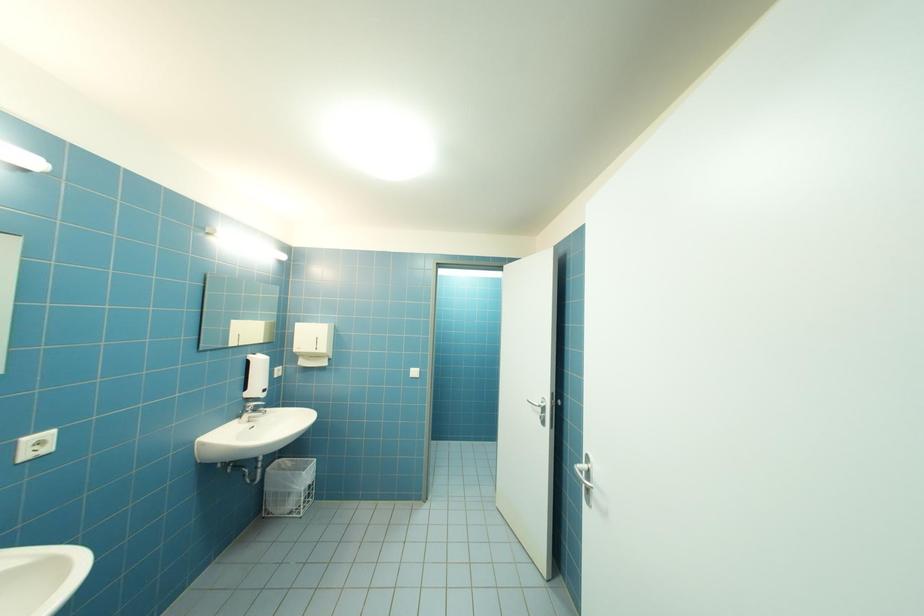
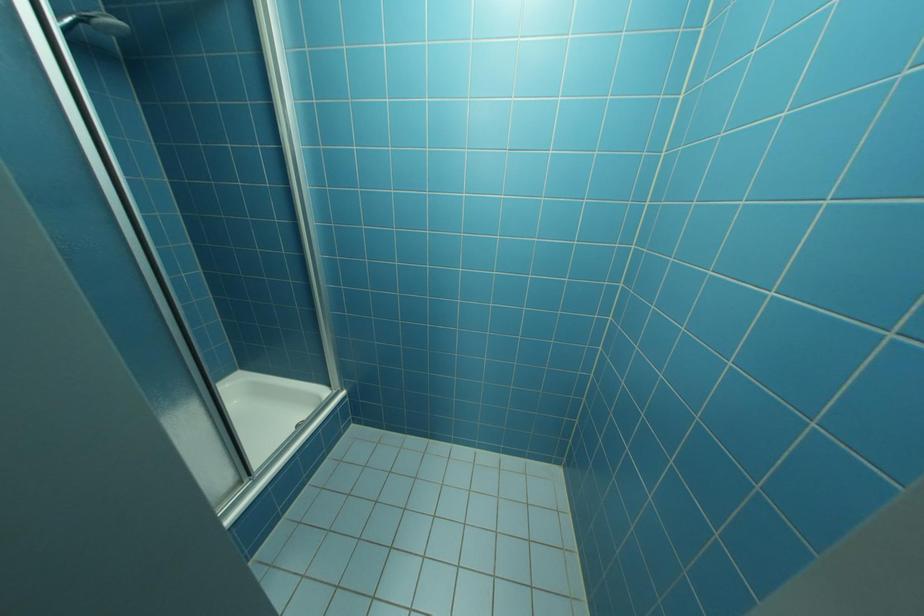
Question: Which direction would the cameraman need to move to produce the second image? Reply with the corresponding letter.

Choices:
 (A) Left
 (B) Right
 (C) Forward
 (D) Backward

Answer: (C)